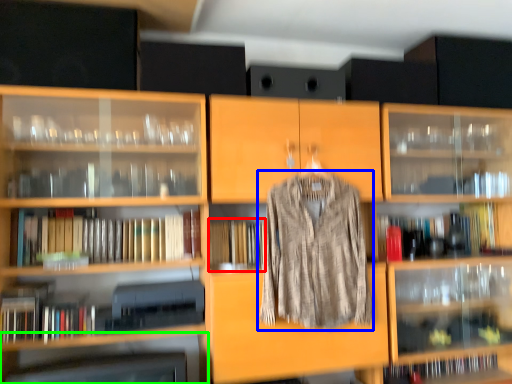
Question: Which object is the farthest from book (highlighted by a red box)? Choose among these: clothing (highlighted by a blue box) or shelf (highlighted by a green box).

Choices:
 (A) clothing
 (B) shelf

Answer: (B)